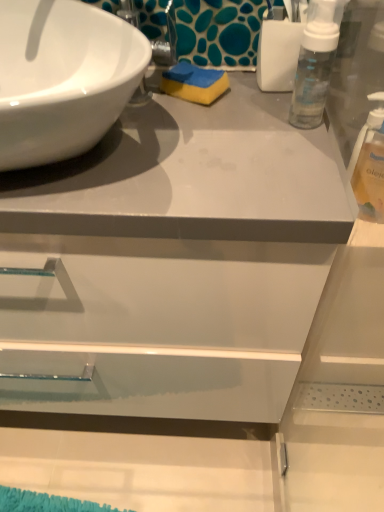
Question: Does white glossy sink at upper left have a greater width compared to blue/yellow sponge at center?

Choices:
 (A) yes
 (B) no

Answer: (A)

Question: Considering the relative sizes of white glossy sink at upper left and blue/yellow sponge at center in the image provided, is white glossy sink at upper left taller than blue/yellow sponge at center?

Choices:
 (A) yes
 (B) no

Answer: (A)

Question: Considering the relative sizes of white glossy sink at upper left and blue/yellow sponge at center in the image provided, is white glossy sink at upper left thinner than blue/yellow sponge at center?

Choices:
 (A) no
 (B) yes

Answer: (A)

Question: From the image's perspective, is white glossy sink at upper left located above blue/yellow sponge at center?

Choices:
 (A) no
 (B) yes

Answer: (A)

Question: Is white glossy sink at upper left oriented away from blue/yellow sponge at center?

Choices:
 (A) no
 (B) yes

Answer: (A)

Question: From a real-world perspective, is blue/yellow sponge at center above or below white glossy sink at upper left?

Choices:
 (A) below
 (B) above

Answer: (A)

Question: Considering the positions of blue/yellow sponge at center and white glossy sink at upper left in the image, is blue/yellow sponge at center taller or shorter than white glossy sink at upper left?

Choices:
 (A) tall
 (B) short

Answer: (B)

Question: Based on their positions, is blue/yellow sponge at center located to the left or right of white glossy sink at upper left?

Choices:
 (A) left
 (B) right

Answer: (B)

Question: Based on their sizes in the image, would you say blue/yellow sponge at center is bigger or smaller than white glossy sink at upper left?

Choices:
 (A) small
 (B) big

Answer: (A)

Question: Looking at their shapes, would you say blue/yellow sponge at center is wider or thinner than clear plastic bottle at right?

Choices:
 (A) wide
 (B) thin

Answer: (A)

Question: Relative to clear plastic bottle at right, is blue/yellow sponge at center in front or behind?

Choices:
 (A) behind
 (B) front

Answer: (A)

Question: From a real-world perspective, relative to clear plastic bottle at right, is blue/yellow sponge at center vertically above or below?

Choices:
 (A) below
 (B) above

Answer: (B)

Question: Would you say blue/yellow sponge at center is to the left or to the right of clear plastic bottle at right in the picture?

Choices:
 (A) left
 (B) right

Answer: (A)

Question: From the image's perspective, is clear plastic bottle at right located above or below blue/yellow sponge at center?

Choices:
 (A) above
 (B) below

Answer: (B)

Question: Based on their sizes in the image, would you say clear plastic bottle at right is bigger or smaller than blue/yellow sponge at center?

Choices:
 (A) big
 (B) small

Answer: (A)